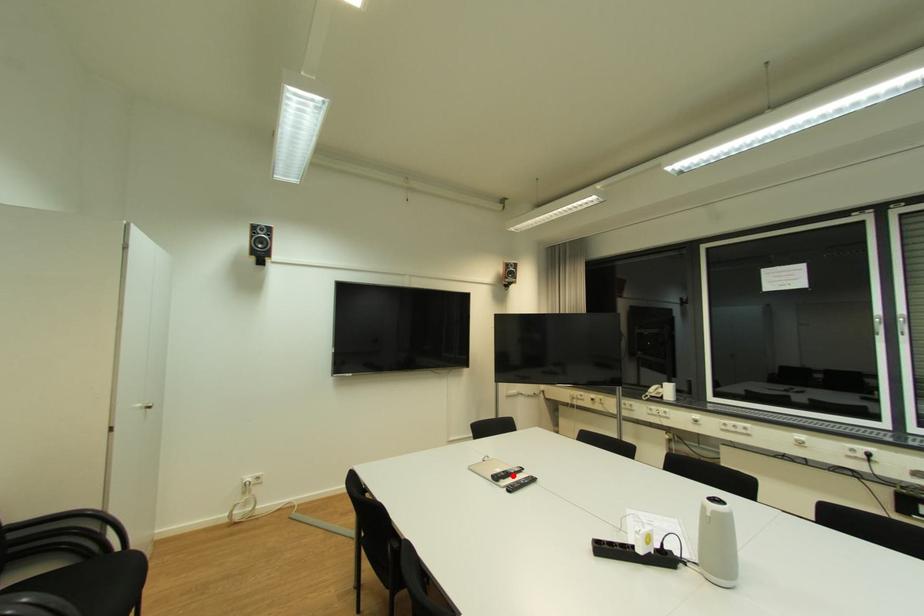
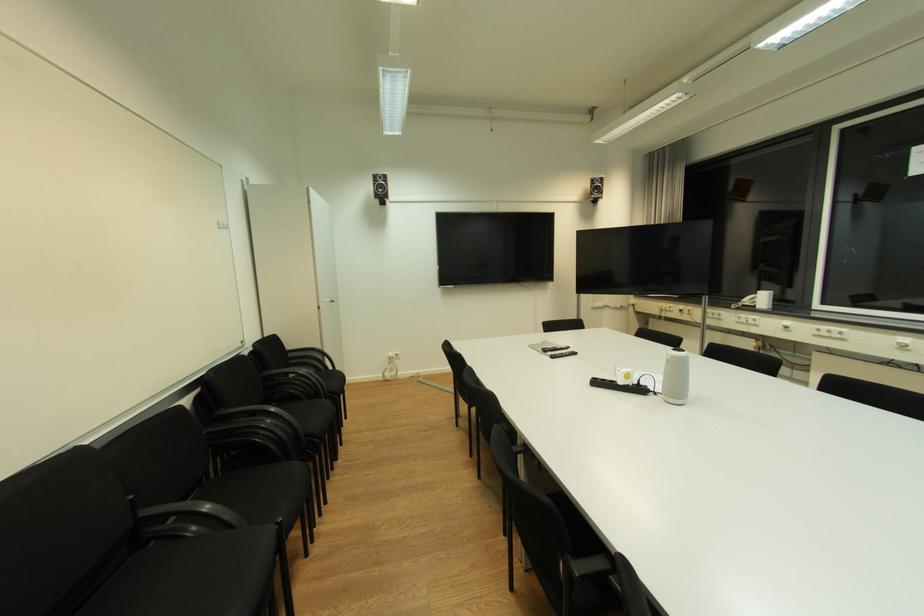
The point at the highlighted location is marked in the first image. Where is the corresponding point in the second image?

(561, 350)